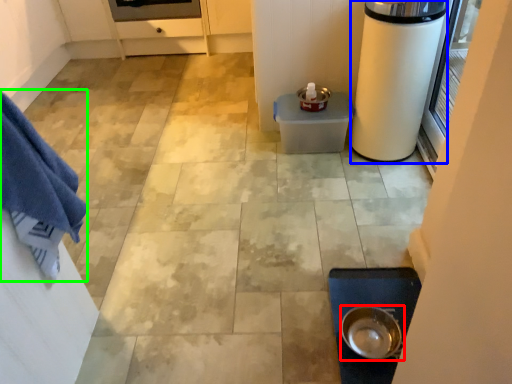
Question: Which object is positioned closest to kitchen appliance (highlighted by a red box)? Select from appliance (highlighted by a blue box) and bath towel (highlighted by a green box).

Choices:
 (A) appliance
 (B) bath towel

Answer: (A)